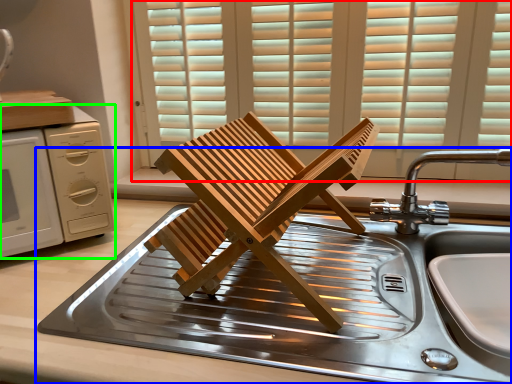
Question: Estimate the real-world distances between objects in this image. Which object is closer to window (highlighted by a red box), sink (highlighted by a blue box) or home appliance (highlighted by a green box)?

Choices:
 (A) sink
 (B) home appliance

Answer: (A)